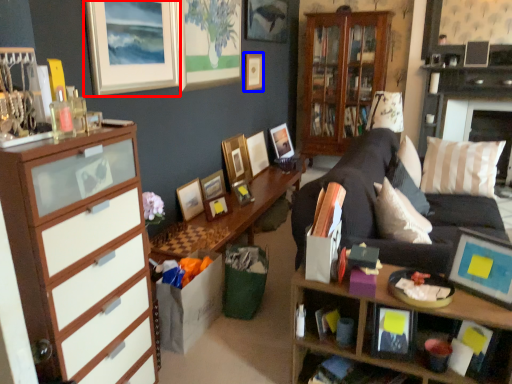
Question: Which point is closer to the camera, picture frame (highlighted by a red box) or picture frame (highlighted by a blue box)?

Choices:
 (A) picture frame
 (B) picture frame

Answer: (A)